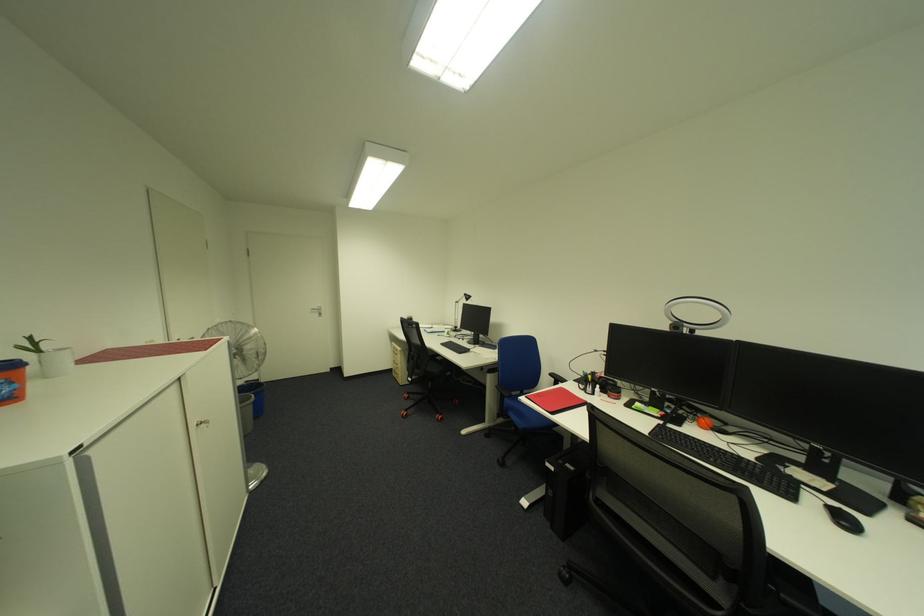
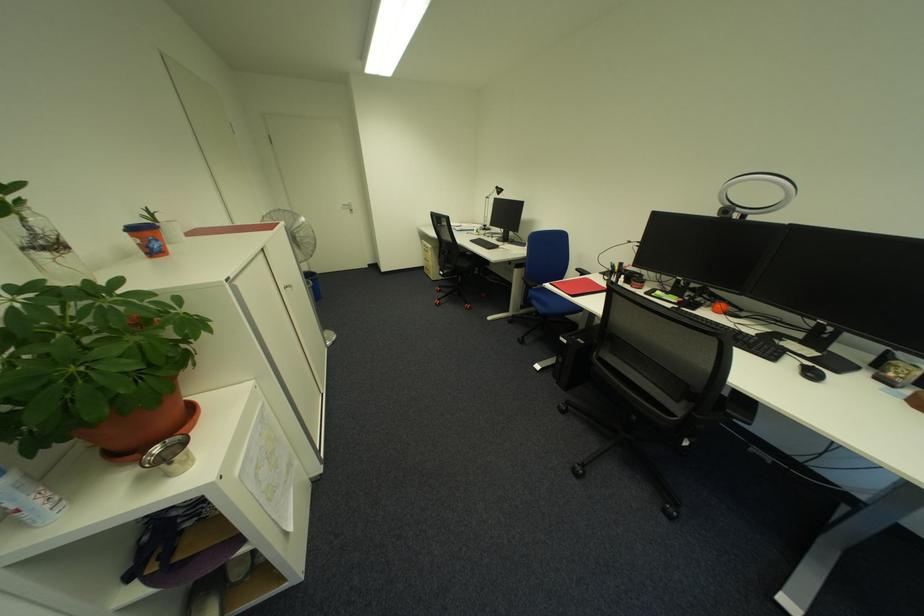
Question: The images are taken continuously from a first-person perspective. In which direction is your viewpoint rotating?

Choices:
 (A) Left
 (B) Right
 (C) Up
 (D) Down

Answer: (D)